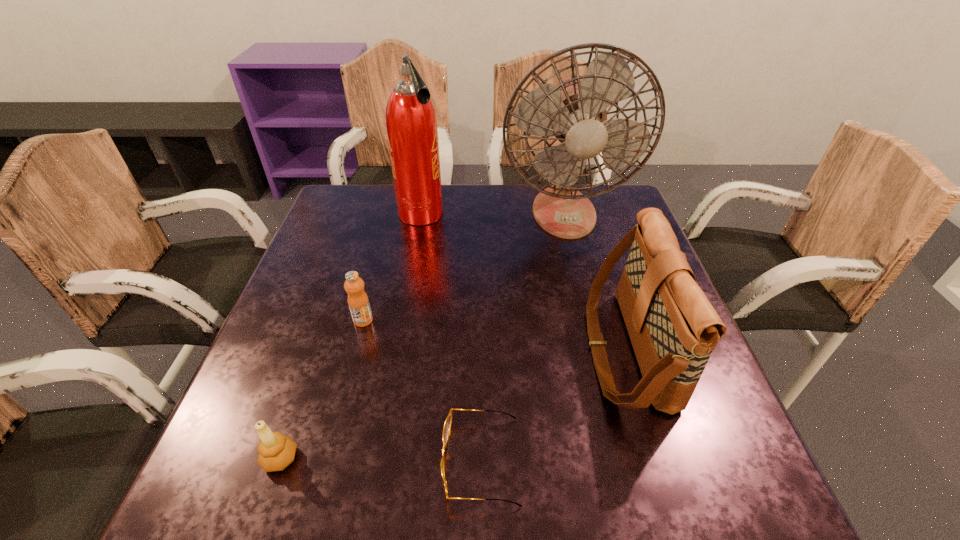
Where is `vacant space at the far left corner of the desktop`? The image size is (960, 540). vacant space at the far left corner of the desktop is located at coordinates (372, 200).

The image size is (960, 540). Identify the location of vacant region at the far right corner of the desktop. (587, 191).

Find the location of a particular element. This screenshot has height=540, width=960. free spot between the orange juice and the spectacles is located at coordinates (422, 390).

This screenshot has height=540, width=960. I want to click on empty space that is in between the leftmost object and the orange juice, so click(x=322, y=389).

This screenshot has width=960, height=540. In order to click on vacant space that's between the orange juice and the fire extinguisher in this screenshot , I will do `click(392, 268)`.

Where is `free space that is in between the fifth tallest object and the fan`? free space that is in between the fifth tallest object and the fan is located at coordinates (422, 335).

This screenshot has height=540, width=960. Find the location of `free spot between the fan and the candle_holder`. free spot between the fan and the candle_holder is located at coordinates (422, 335).

At what (x,y) coordinates should I click in order to perform the action: click on vacant point located between the fire extinguisher and the orange juice. Please return your answer as a coordinate pair (x, y). This screenshot has width=960, height=540. Looking at the image, I should click on (392, 268).

Find the location of a particular element. vacant area that lies between the second shortest object and the fire extinguisher is located at coordinates (350, 337).

The image size is (960, 540). In order to click on vacant point located between the orange juice and the shoulder bag in this screenshot , I will do `click(494, 335)`.